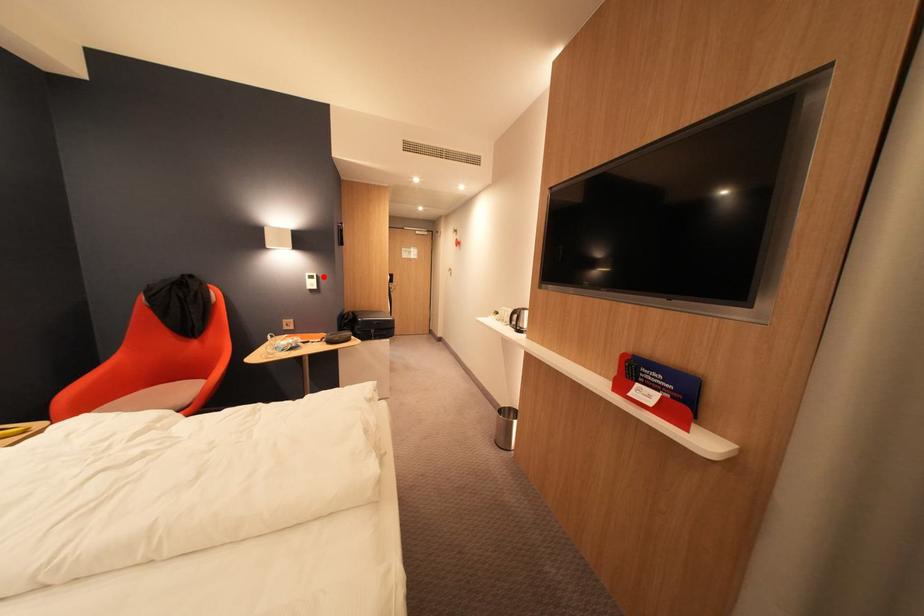
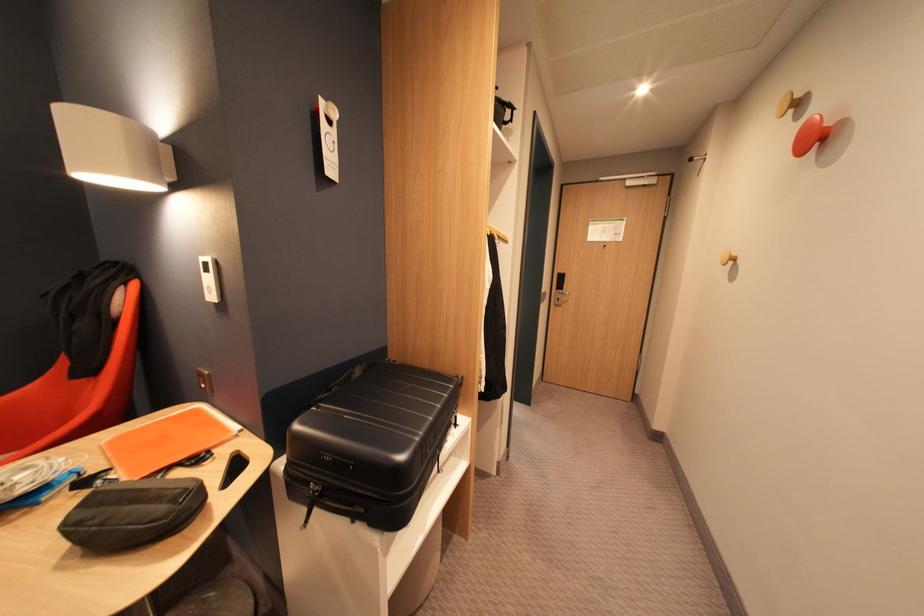
Question: I am providing you with two images of the same scene from different viewpoints. Given a red point in image1, look at the same physical point in image2. Is it:

Choices:
 (A) Closer to the viewpoint
 (B) Farther from the viewpoint

Answer: (B)